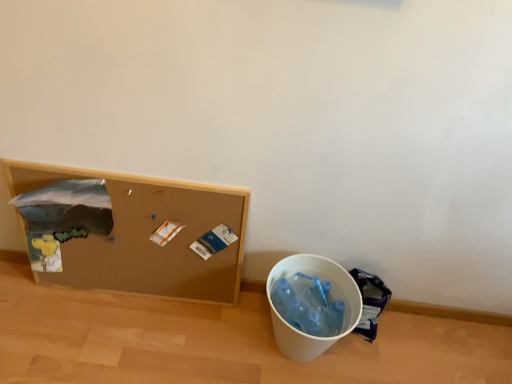
Measure the distance between point (184, 269) and camera.

They are 4.56 feet apart.

Measure the distance between point (351, 285) and camera.

Point (351, 285) and camera are 4.23 feet apart from each other.

Image resolution: width=512 pixels, height=384 pixels. I want to click on brown corkboard at left, so click(x=147, y=235).

Between brown corkboard at left and blue plastic bag at lower right, which one appears on the right side from the viewer's perspective?

From the viewer's perspective, blue plastic bag at lower right appears more on the right side.

Considering the relative sizes of brown corkboard at left and blue plastic bag at lower right in the image provided, is brown corkboard at left thinner than blue plastic bag at lower right?

Correct, the width of brown corkboard at left is less than that of blue plastic bag at lower right.

From the image's perspective, is brown corkboard at left on blue plastic bag at lower right?

Yes, from the image's perspective, brown corkboard at left is above blue plastic bag at lower right.

How different are the orientations of brown corkboard at left and blue plastic bag at lower right in degrees?

The angle between the facing direction of brown corkboard at left and the facing direction of blue plastic bag at lower right is 0.731 degrees.

Is white plastic bucket at lower right positioned with its back to brown corkboard at left?

That's not correct — white plastic bucket at lower right is not looking away from brown corkboard at left.

Is white plastic bucket at lower right outside of brown corkboard at left?

That's correct, white plastic bucket at lower right is outside of brown corkboard at left.

Where is `furniture on the left of the white plastic bucket at lower right`? This screenshot has height=384, width=512. furniture on the left of the white plastic bucket at lower right is located at coordinates (147, 235).

From a real-world perspective, is white plastic bucket at lower right above or below brown corkboard at left?

white plastic bucket at lower right is below brown corkboard at left.

Considering the relative sizes of blue plastic bag at lower right and white plastic bucket at lower right in the image provided, is blue plastic bag at lower right taller than white plastic bucket at lower right?

Incorrect, the height of blue plastic bag at lower right is not larger of that of white plastic bucket at lower right.

Who is bigger, blue plastic bag at lower right or white plastic bucket at lower right?

Bigger between the two is white plastic bucket at lower right.

Can we say blue plastic bag at lower right lies outside white plastic bucket at lower right?

Indeed, blue plastic bag at lower right is completely outside white plastic bucket at lower right.

At what (x,y) coordinates should I click in order to perform the action: click on garbage below the white plastic bucket at lower right (from a real-world perspective). Please return your answer as a coordinate pair (x, y). Looking at the image, I should click on (370, 302).

Would you say white plastic bucket at lower right is inside or outside blue plastic bag at lower right?

white plastic bucket at lower right lies outside blue plastic bag at lower right.

Does white plastic bucket at lower right have a greater height compared to blue plastic bag at lower right?

Yes.

Is white plastic bucket at lower right beside blue plastic bag at lower right?

white plastic bucket at lower right and blue plastic bag at lower right are clearly separated.

Does point (140, 246) lie in front of point (347, 283)?

No, it is not.

Based on their positions, is brown corkboard at left located to the left or right of white plastic bucket at lower right?

From the image, it's evident that brown corkboard at left is to the left of white plastic bucket at lower right.

In terms of width, does brown corkboard at left look wider or thinner when compared to white plastic bucket at lower right?

Clearly, brown corkboard at left has less width compared to white plastic bucket at lower right.

Is blue plastic bag at lower right thinner than brown corkboard at left?

No.

Based on their sizes in the image, would you say blue plastic bag at lower right is bigger or smaller than brown corkboard at left?

In the image, blue plastic bag at lower right appears to be smaller than brown corkboard at left.

Based on the photo, from the image's perspective, is blue plastic bag at lower right below brown corkboard at left?

Yes, from the image's perspective, blue plastic bag at lower right is below brown corkboard at left.

Measure the distance between blue plastic bag at lower right and brown corkboard at left.

The distance of blue plastic bag at lower right from brown corkboard at left is 62.69 centimeters.

Identify the location of furniture in front of the blue plastic bag at lower right. (147, 235).

Find the location of a particular element. Image resolution: width=512 pixels, height=384 pixels. recycling bin on the right of brown corkboard at left is located at coordinates (333, 296).

Looking at the image, which one is located closer to brown corkboard at left, blue plastic bag at lower right or white plastic bucket at lower right?

Based on the image, white plastic bucket at lower right appears to be nearer to brown corkboard at left.

Estimate the real-world distances between objects in this image. Which object is further from brown corkboard at left, white plastic bucket at lower right or blue plastic bag at lower right?

blue plastic bag at lower right is further to brown corkboard at left.

Looking at the image, which one is located further to white plastic bucket at lower right, blue plastic bag at lower right or brown corkboard at left?

brown corkboard at left.

When comparing their distances from blue plastic bag at lower right, does white plastic bucket at lower right or brown corkboard at left seem further?

brown corkboard at left is further to blue plastic bag at lower right.

Consider the image. Considering their positions, is brown corkboard at left positioned closer to blue plastic bag at lower right than white plastic bucket at lower right?

white plastic bucket at lower right is positioned closer to the anchor blue plastic bag at lower right.

When comparing their distances from white plastic bucket at lower right, does brown corkboard at left or blue plastic bag at lower right seem further?

Based on the image, brown corkboard at left appears to be further to white plastic bucket at lower right.

I want to click on recycling bin situated between brown corkboard at left and blue plastic bag at lower right from left to right, so click(x=333, y=296).